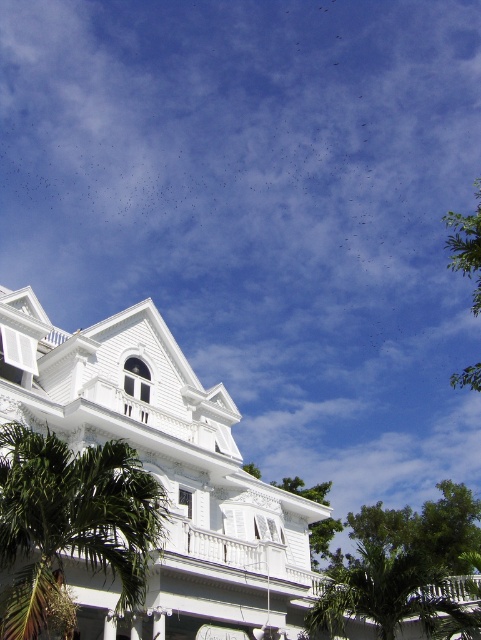
Image resolution: width=481 pixels, height=640 pixels. What do you see at coordinates (72, 520) in the screenshot?
I see `green leafy palm tree at lower left` at bounding box center [72, 520].

Between point (113, 554) and point (332, 582), which one is positioned in front?

Point (113, 554)

Identify the location of green leafy palm tree at lower left. This screenshot has height=640, width=481. pyautogui.click(x=72, y=520).